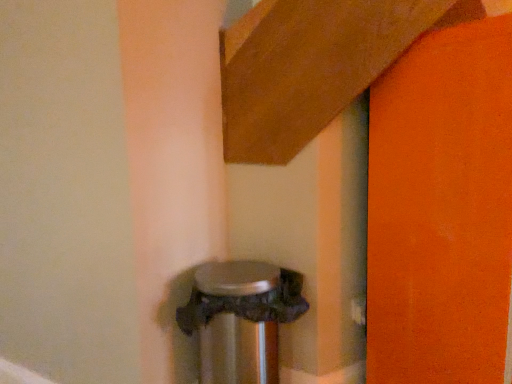
What do you see at coordinates (240, 319) in the screenshot? I see `metallic silver bar stool at lower center` at bounding box center [240, 319].

Image resolution: width=512 pixels, height=384 pixels. I want to click on metallic silver bar stool at lower center, so click(x=240, y=319).

Locate an element on the screen. metallic silver bar stool at lower center is located at coordinates (240, 319).